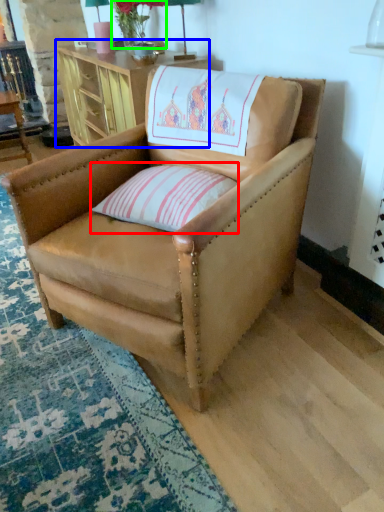
Question: Based on their relative distances, which object is farther from pillow (highlighted by a red box)? Choose from table (highlighted by a blue box) and flower (highlighted by a green box).

Choices:
 (A) table
 (B) flower

Answer: (B)